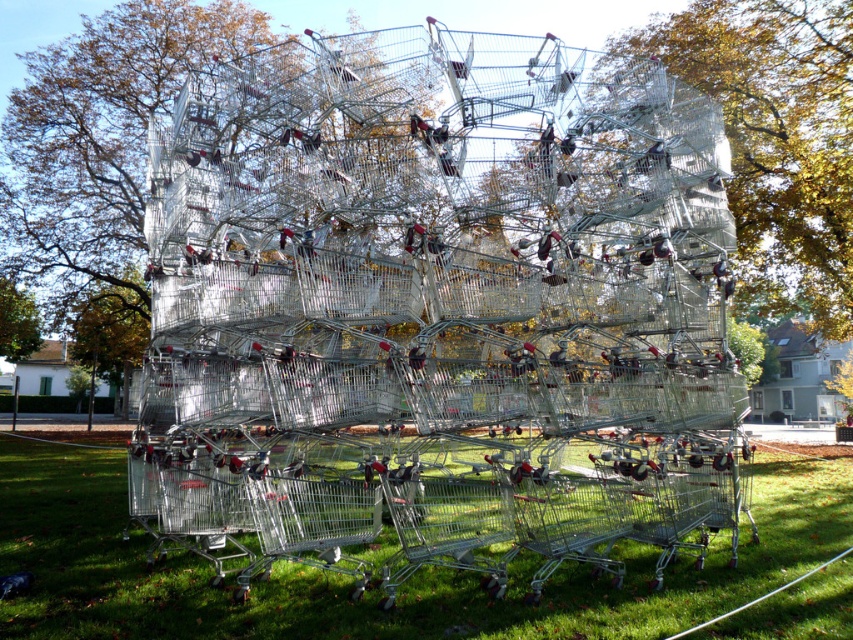
Based on the scene description, which tree has a smaller trunk diameter between the green leafy tree at center and the green leafy tree at upper left?

The green leafy tree at center has a smaller trunk diameter compared to the green leafy tree at upper left.

You are standing at the origin point of the coordinate system placed at the bottom left corner of the image. You want to locate the metallic silver shopping cart at center. What are its coordinates?

The metallic silver shopping cart at center is located at coordinates point [438,289].